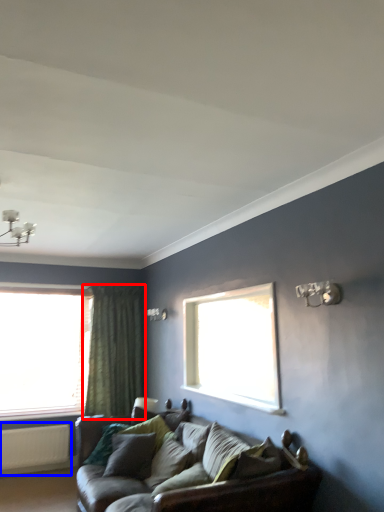
Question: Which of the following is the closest to the observer, curtain (highlighted by a red box) or radiator (highlighted by a blue box)?

Choices:
 (A) curtain
 (B) radiator

Answer: (B)